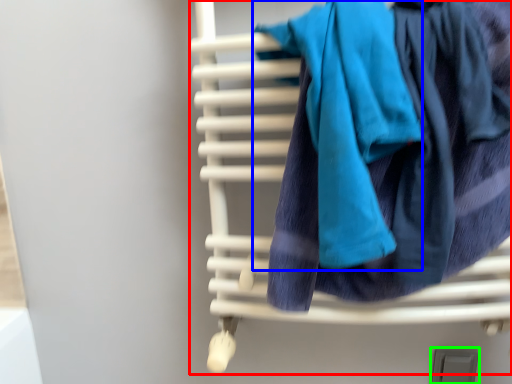
Question: Considering the real-world distances, which object is closest to furniture (highlighted by a red box)? bath towel (highlighted by a blue box) or window (highlighted by a green box).

Choices:
 (A) bath towel
 (B) window

Answer: (A)